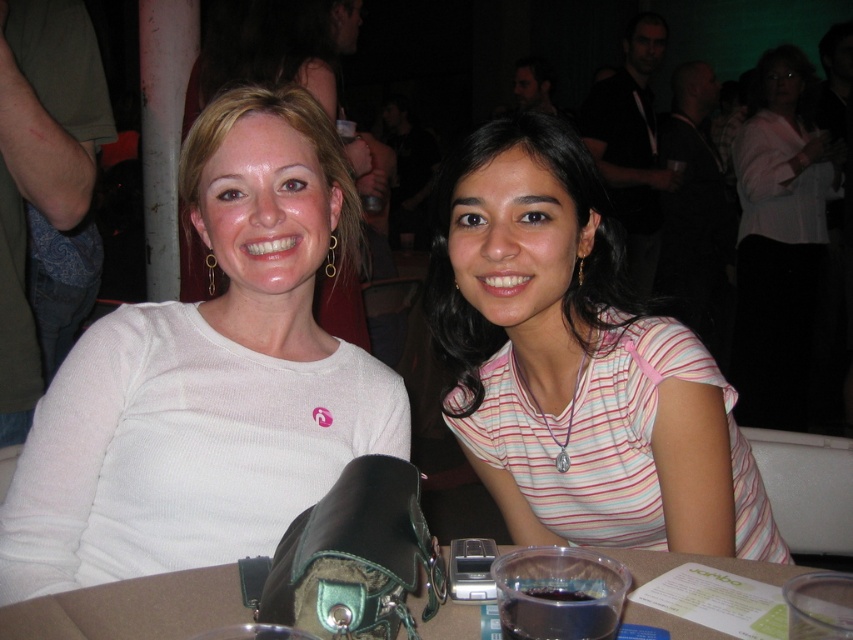
Question: Does pink striped shirt at center have a larger size compared to brown leather table at center?

Choices:
 (A) no
 (B) yes

Answer: (B)

Question: Among these points, which one is farthest from the camera?

Choices:
 (A) (793, 417)
 (B) (73, 624)

Answer: (A)

Question: Is pink striped shirt at center thinner than pink fabric shirt at center?

Choices:
 (A) yes
 (B) no

Answer: (A)

Question: Estimate the real-world distances between objects in this image. Which object is closer to the white matte sweater at center?

Choices:
 (A) pink fabric shirt at center
 (B) brown leather table at center
 (C) pink striped shirt at center

Answer: (C)

Question: Is white matte sweater at center positioned at the back of pink fabric shirt at center?

Choices:
 (A) no
 (B) yes

Answer: (A)

Question: Which object appears farthest from the camera in this image?

Choices:
 (A) pink striped shirt at center
 (B) pink fabric shirt at center
 (C) brown leather table at center

Answer: (B)